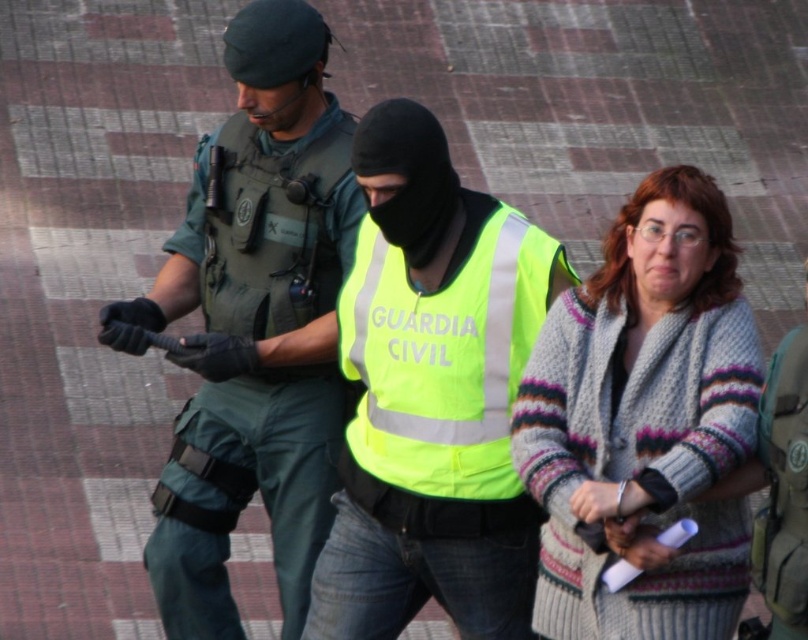
You are a drone operator trying to locate a specific point in a law enforcement scene. The point is marked as point (271, 93). Given that the point is 142.49 feet away from you, can your drone, which has a maximum operational range of 150 feet, reach it?

The point (271, 93) is 142.49 feet away from the viewer, so yes, the drone can reach it since its maximum operational range is 150 feet.

You are an observer at the scene. You see a person wearing a knitted sweater at center and a neon yellow reflective vest at center. Which clothing item is closer to the top of the person?

The knitted sweater at center is located above the neon yellow reflective vest at center, so the knitted sweater at center is closer to the top of the person.